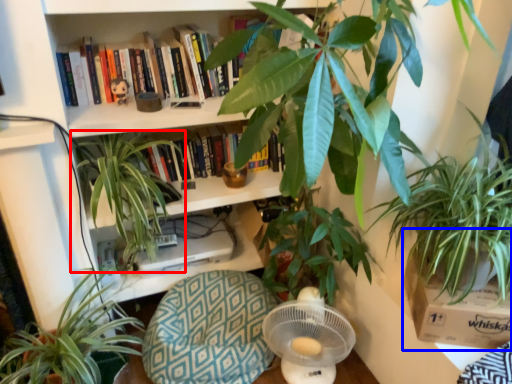
Question: Among these objects, which one is farthest to the camera, houseplant (highlighted by a red box) or cardboard box (highlighted by a blue box)?

Choices:
 (A) houseplant
 (B) cardboard box

Answer: (A)